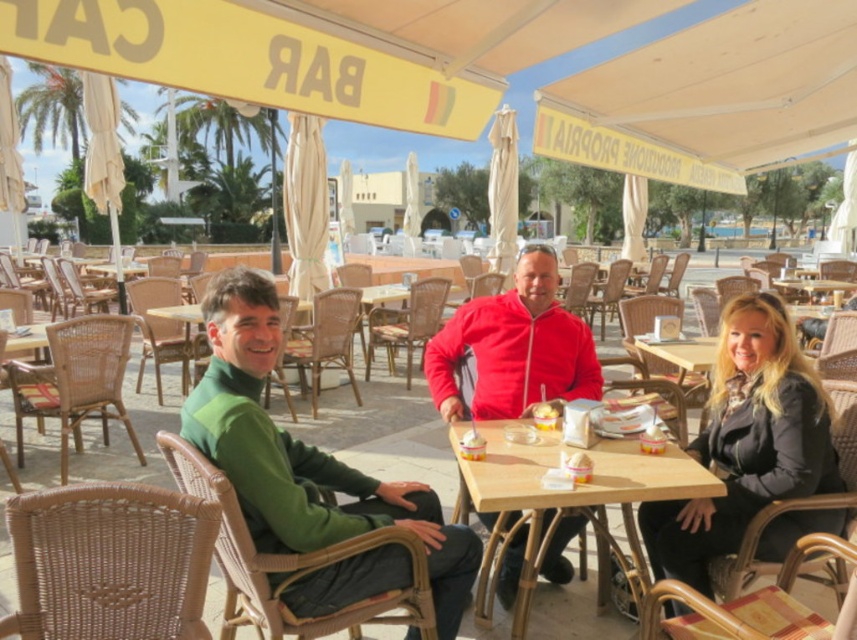
Question: Is green woven sweater at center bigger than wooden table at center?

Choices:
 (A) no
 (B) yes

Answer: (B)

Question: Can you confirm if green woven sweater at center is smaller than velvet red jacket at center?

Choices:
 (A) yes
 (B) no

Answer: (B)

Question: From the image, what is the correct spatial relationship of green woven sweater at center in relation to black leather jacket at lower right?

Choices:
 (A) right
 (B) left

Answer: (B)

Question: Which of the following is the closest to the observer?

Choices:
 (A) (463, 509)
 (B) (487, 394)

Answer: (B)

Question: Which of these objects is positioned closest to the black leather jacket at lower right?

Choices:
 (A) velvet red jacket at center
 (B) green woven sweater at center

Answer: (A)

Question: Among these points, which one is nearest to the camera?

Choices:
 (A) (805, 372)
 (B) (548, 248)
 (C) (517, 451)
 (D) (382, 522)

Answer: (D)